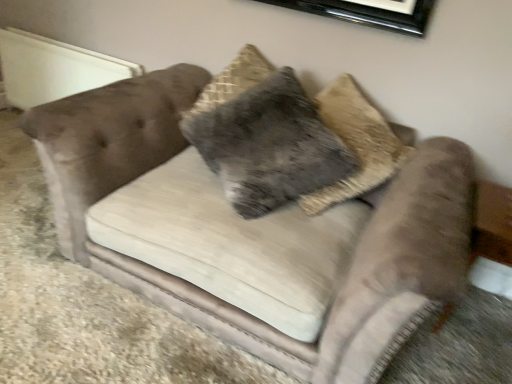
What do you see at coordinates (269, 145) in the screenshot?
I see `velvet gray pillow at center` at bounding box center [269, 145].

Measure the distance between velvet gray pillow at center and camera.

The depth of velvet gray pillow at center is 1.63 meters.

Locate an element on the screen. velvet gray pillow at center is located at coordinates pos(269,145).

Image resolution: width=512 pixels, height=384 pixels. What are the coordinates of `velvet gray pillow at center` in the screenshot? It's located at (269, 145).